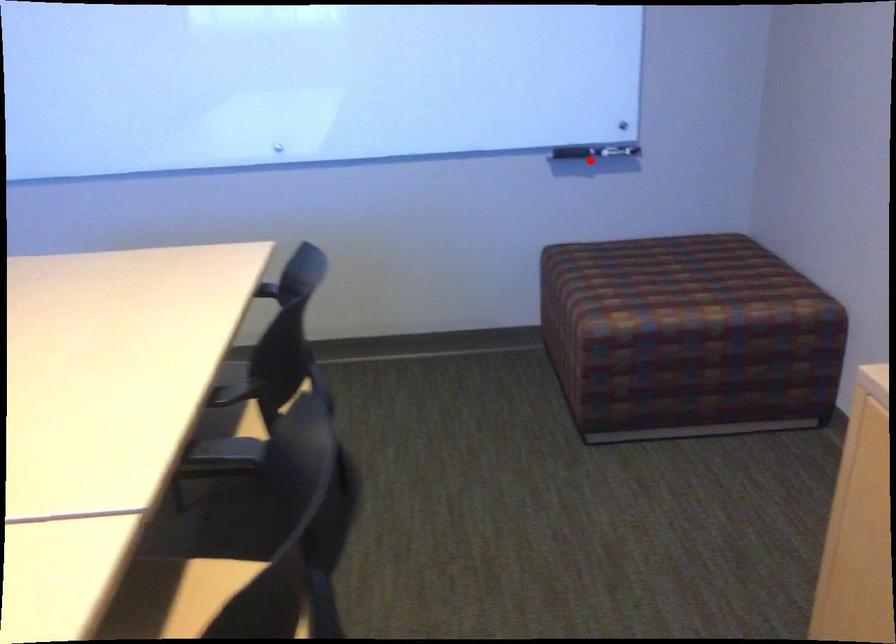
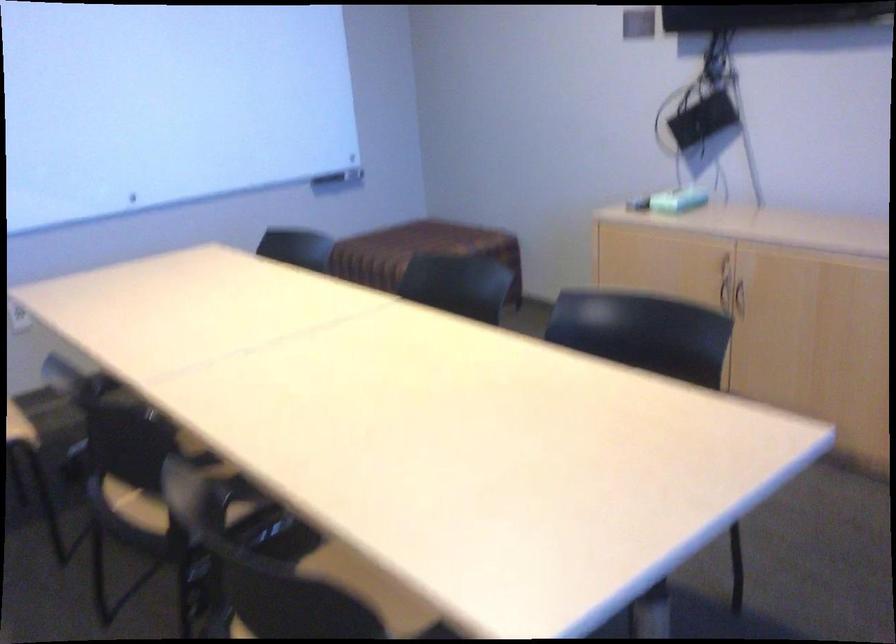
The point at the highlighted location is marked in the first image. Where is the corresponding point in the second image?

(339, 178)